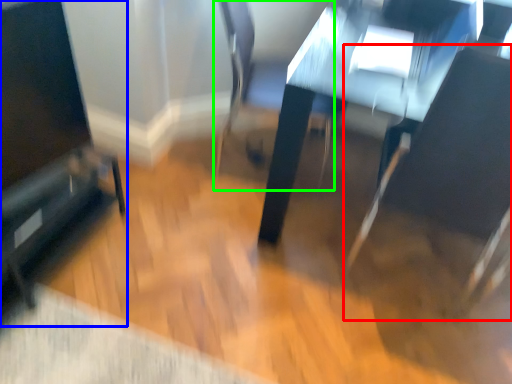
Question: Which object is positioned farthest from swivel chair (highlighted by a red box)? Select from furniture (highlighted by a blue box) and swivel chair (highlighted by a green box).

Choices:
 (A) furniture
 (B) swivel chair

Answer: (A)